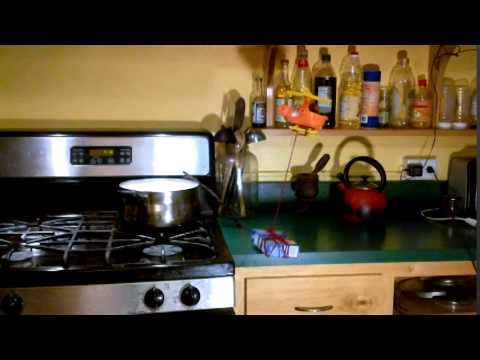
Find the location of a particular element. The image size is (480, 360). shelf is located at coordinates (410, 132).